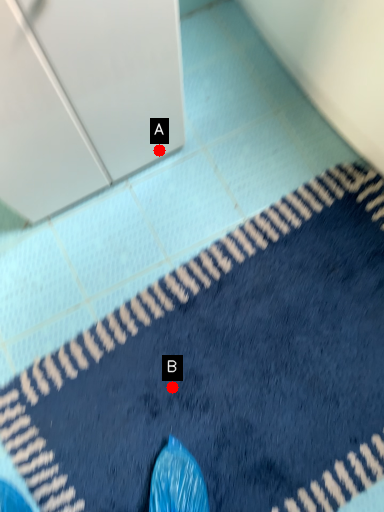
Question: Two points are circled on the image, labeled by A and B beside each circle. Which of the following is the farthest from the observer?

Choices:
 (A) A is further
 (B) B is further

Answer: (A)